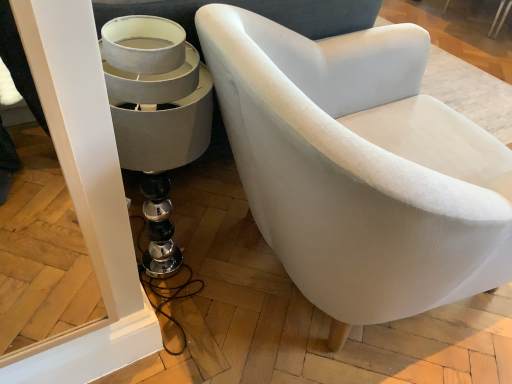
Where is `white fabric chair at center`? This screenshot has width=512, height=384. white fabric chair at center is located at coordinates (358, 169).

Describe the element at coordinates (358, 169) in the screenshot. I see `white fabric chair at center` at that location.

Locate an element on the screen. white fabric chair at center is located at coordinates (358, 169).